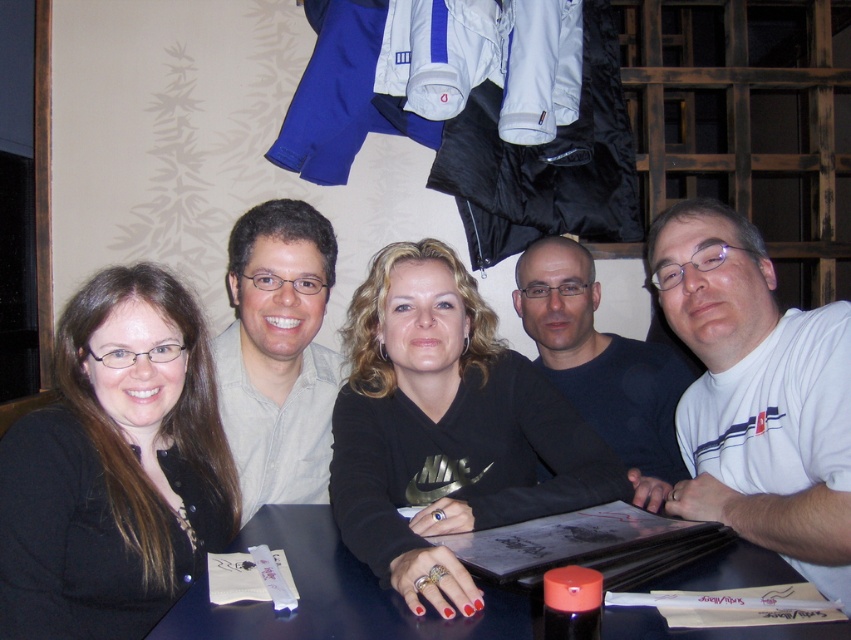
Question: Which object is closer to the camera taking this photo?

Choices:
 (A) light gray shirt at center
 (B) black matte/black sweater at center
 (C) white t-shirt at right
 (D) black matte/black shirt at left

Answer: (B)

Question: Does black matte/black sweater at center have a greater width compared to light gray shirt at center?

Choices:
 (A) no
 (B) yes

Answer: (B)

Question: Is black matte/black sweater at center wider than black matte/black shirt at left?

Choices:
 (A) yes
 (B) no

Answer: (A)

Question: Among these points, which one is farthest from the camera?

Choices:
 (A) (249, 608)
 (B) (640, 353)
 (C) (184, 472)
 (D) (289, 330)

Answer: (B)

Question: Where is black matte/black sweater at center located in relation to smooth dark wood table at center in the image?

Choices:
 (A) above
 (B) below

Answer: (A)

Question: Which point is farther from the camera taking this photo?

Choices:
 (A) (568, 380)
 (B) (203, 388)
 (C) (415, 396)

Answer: (A)